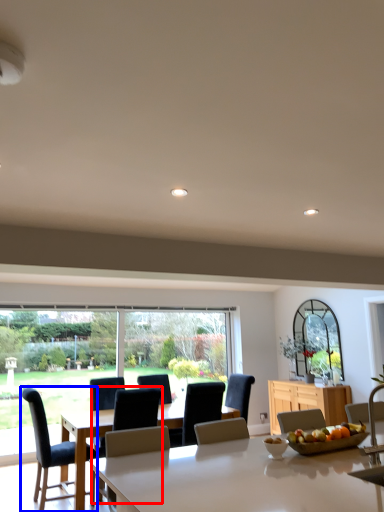
Question: Which of the following is the closest to the observer, chair (highlighted by a red box) or chair (highlighted by a blue box)?

Choices:
 (A) chair
 (B) chair

Answer: (A)